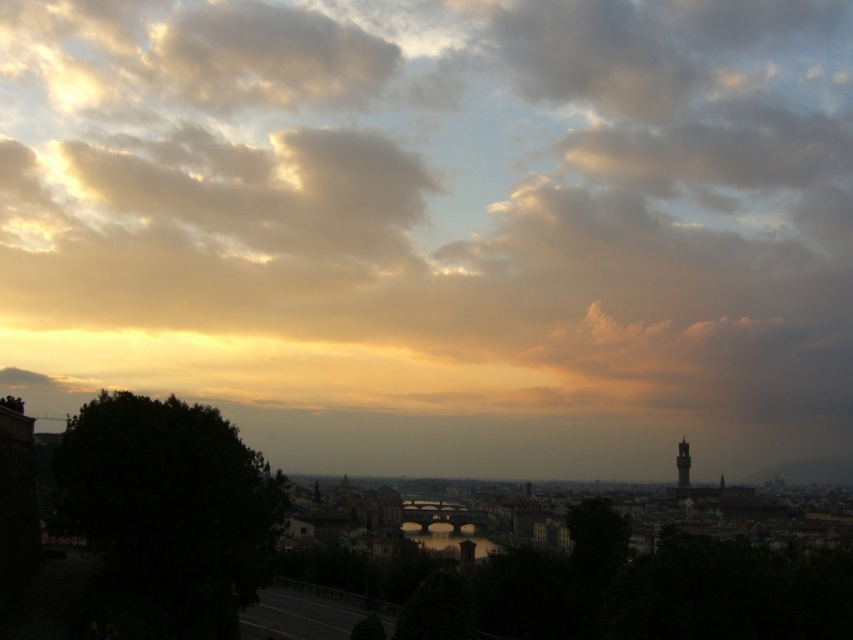
Based on the photo, what are the coordinates of the cloudy sky at upper center in the image?

The cloudy sky at upper center is located at coordinates point (433, 204).

You are a city planner analyzing this cityscape. You need to determine if the dark gray stone tower at right can be seen from the rooftop of a building located directly behind the cloudy sky at upper center. Based on their heights, is this possible?

The cloudy sky at upper center is much taller than the dark gray stone tower at right. Since the sky is higher, the tower would be obscured by the sky, making it impossible to see from the rooftop behind the cloudy sky at upper center.

What is located at the coordinates point (433,204) in the cityscape image?

The cloudy sky at upper center is located at point (433,204).